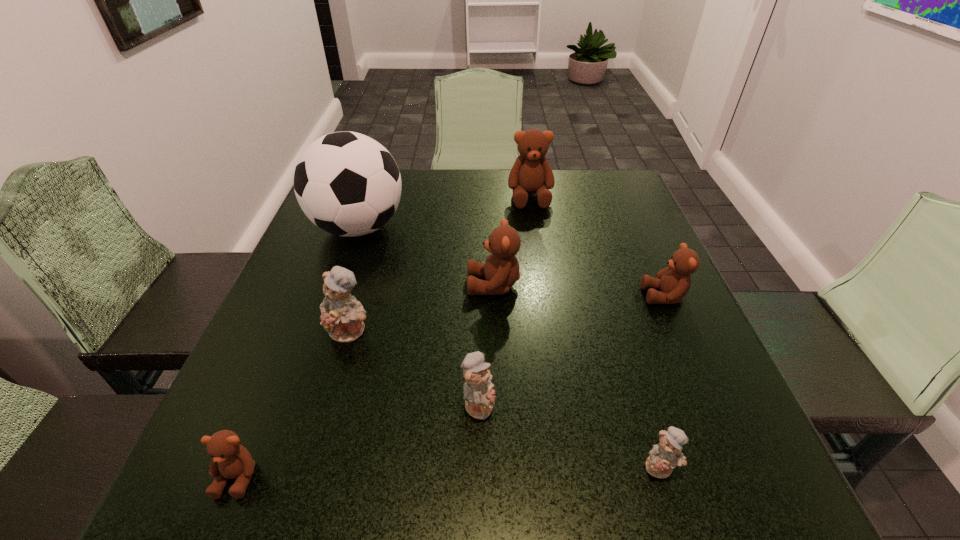
Identify which brown teddy bear is the fourth closest to the soccer ball. Please provide its 2D coordinates. Your answer should be formatted as a tuple, i.e. [(x, y)], where the tuple contains the x and y coordinates of a point satisfying the conditions above.

[(674, 281)]

Find the location of a particular element. blue teddy bear that can be found as the second closest to the soccer ball is located at coordinates (479, 396).

The width and height of the screenshot is (960, 540). I want to click on blue teddy bear that is the nearest to the black soccer ball, so click(x=342, y=316).

Where is `free space that satisfies the following two spatial constraints: 1. on the face of the farthest teddy bear; 2. on the face of the second biggest brown teddy bear`? This screenshot has height=540, width=960. free space that satisfies the following two spatial constraints: 1. on the face of the farthest teddy bear; 2. on the face of the second biggest brown teddy bear is located at coordinates (544, 285).

Where is `free region that satisfies the following two spatial constraints: 1. on the face of the seventh shortest object; 2. on the face of the third smallest brown teddy bear`? Image resolution: width=960 pixels, height=540 pixels. free region that satisfies the following two spatial constraints: 1. on the face of the seventh shortest object; 2. on the face of the third smallest brown teddy bear is located at coordinates (544, 285).